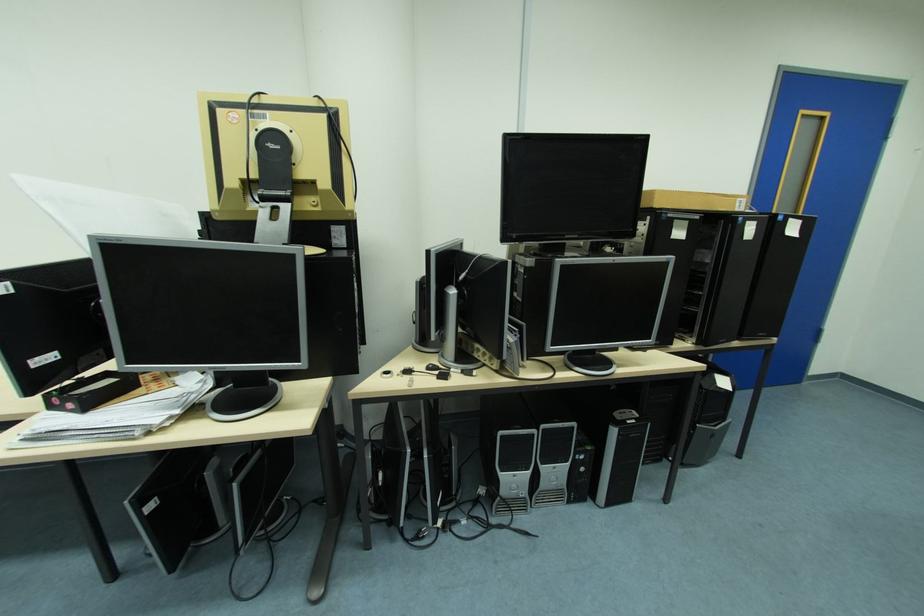
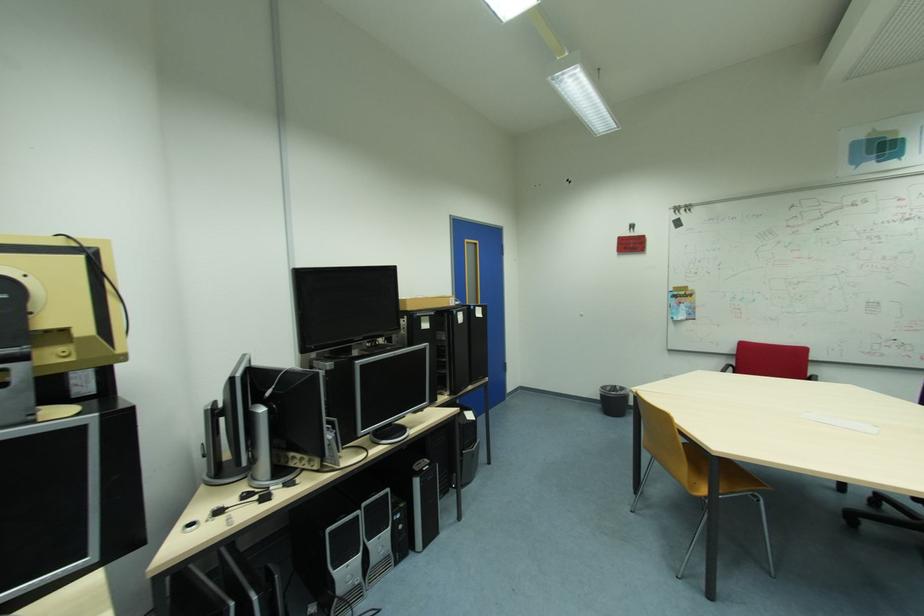
Question: I am providing you with two images of the same scene from different viewpoints. Please identify which objects are invisible in image2.

Choices:
 (A) blue door handle
 (B) black computer tower
 (C) black trash can
 (D) none of these

Answer: (D)